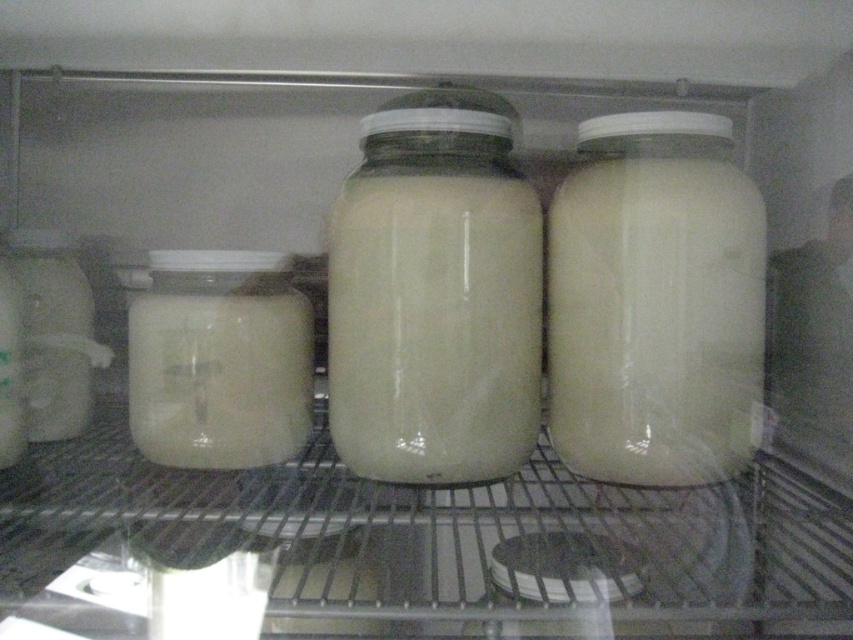
You are organizing the fridge and want to place a new jar between the white glossy jar at right and the white matte jar at left. Considering their sizes, which jar should you place the new jar next to to ensure it fits better?

The white glossy jar at right occupies less space than the white matte jar at left, so placing the new jar next to the white glossy jar at right would provide more space for it to fit better.

You are trying to reach a jar located at point (726, 442) inside the fridge. Your hand can extend 22 inches. Can you reach it?

The distance between point (726, 442) and the camera is 24.23 inches. Since your hand can only extend 22 inches, you cannot reach the jar at point (726, 442).

You are organizing the refrigerator and need to place a new jar between the white glossy jar at right and the translucent glass jar at left. Based on their positions, where should you place the new jar to maintain the existing arrangement?

The white glossy jar at right is to the right of the translucent glass jar at left, so you should place the new jar to the right of the translucent glass jar at left but to the left of the white glossy jar at right to maintain the existing arrangement.